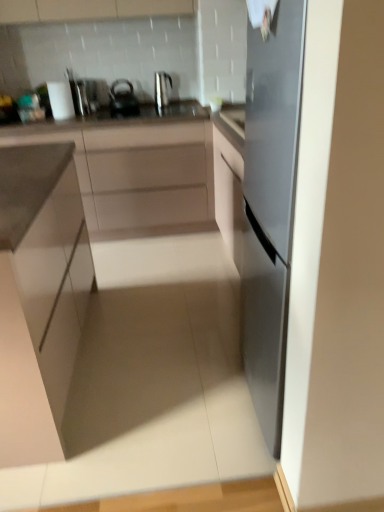
Question: From the image's perspective, is metallic silver kettle at upper center positioned above or below matte black kettle at upper center?

Choices:
 (A) below
 (B) above

Answer: (B)

Question: Looking at the image, does metallic silver kettle at upper center seem bigger or smaller compared to matte black kettle at upper center?

Choices:
 (A) small
 (B) big

Answer: (A)

Question: Which is nearer to the matte white cabinet at left, which appears as the 1th cabinetry when viewed from the front?

Choices:
 (A) matte black kettle at upper center
 (B) white matte cabinet at center, which is the second cabinetry in front-to-back order
 (C) metallic silver kettle at upper center
 (D) satin silver toaster at upper left

Answer: (B)

Question: Which object is positioned closest to the matte black kettle at upper center?

Choices:
 (A) satin silver toaster at upper left
 (B) metallic silver kettle at upper center
 (C) white matte cabinet at center, which is the first cabinetry from back to front
 (D) matte white cabinet at left, the 2th cabinetry when ordered from back to front

Answer: (B)